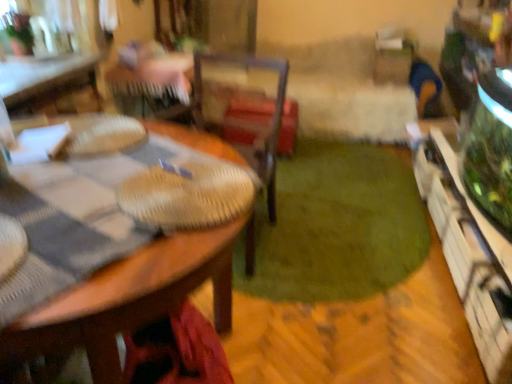
Locate an element on the screen. wooden table at center, which is the 1th table from front to back is located at coordinates (142, 283).

Describe the element at coordinates (337, 226) in the screenshot. I see `green plush carpet at center` at that location.

Where is `wooden table at center, placed as the 2th table when sorted from back to front`? The height and width of the screenshot is (384, 512). wooden table at center, placed as the 2th table when sorted from back to front is located at coordinates (142, 283).

From a real-world perspective, which is physically above, woven wood chair at center or wooden table at upper left, the 2th table when ordered from bottom to top?

wooden table at upper left, the 2th table when ordered from bottom to top, is physically above.

From the image's perspective, who appears lower, woven wood chair at center or wooden table at upper left, placed as the first table when sorted from top to bottom?

Result: woven wood chair at center, from the image's perspective.

Is wooden table at upper left, the 2th table when ordered from bottom to top, inside woven wood chair at center?

No, wooden table at upper left, the 2th table when ordered from bottom to top, is not surrounded by woven wood chair at center.

What's the angular difference between woven wood chair at center and wooden table at upper left, placed as the first table when sorted from top to bottom,'s facing directions?

There is a 97.7-degree angle between the facing directions of woven wood chair at center and wooden table at upper left, placed as the first table when sorted from top to bottom.

Based on the photo, could you measure the distance between wooden table at upper left, the 1th table viewed from the back, and wooden table at center, which is counted as the 2th table, starting from the top?

wooden table at upper left, the 1th table viewed from the back, and wooden table at center, which is counted as the 2th table, starting from the top, are 4.67 feet apart from each other.

In the scene shown: Is wooden table at upper left, which is counted as the 2th table, starting from the front, thinner than wooden table at center, which is the 1th table from front to back?

Yes, wooden table at upper left, which is counted as the 2th table, starting from the front, is thinner than wooden table at center, which is the 1th table from front to back.

Is wooden table at upper left, the 1th table viewed from the back, located outside wooden table at center, the 1th table positioned from the bottom?

wooden table at upper left, the 1th table viewed from the back, is positioned outside wooden table at center, the 1th table positioned from the bottom.

Is wooden table at upper left, the 2th table when ordered from bottom to top, not close to wooden table at center, placed as the 2th table when sorted from back to front?

Yes, wooden table at upper left, the 2th table when ordered from bottom to top, and wooden table at center, placed as the 2th table when sorted from back to front, are located far from each other.

Is wooden table at center, which is the 1th table from front to back, at the back of woven wood chair at center?

woven wood chair at center does not have its back to wooden table at center, which is the 1th table from front to back.

Does point (273, 162) appear closer or farther from the camera than point (79, 299)?

Point (273, 162) is positioned farther from the camera compared to point (79, 299).

From the image's perspective, who appears lower, woven wood chair at center or wooden table at center, the 1th table positioned from the bottom?

wooden table at center, the 1th table positioned from the bottom.

From a real-world perspective, is wooden table at center, placed as the 2th table when sorted from back to front, physically located above or below woven wood chair at center?

From a real-world perspective, wooden table at center, placed as the 2th table when sorted from back to front, is physically below woven wood chair at center.

In the scene shown: Considering the positions of objects wooden table at center, placed as the 2th table when sorted from back to front, and woven wood chair at center in the image provided, who is behind, wooden table at center, placed as the 2th table when sorted from back to front, or woven wood chair at center?

woven wood chair at center is further from the camera.

From the image's perspective, is wooden table at center, the 1th table positioned from the bottom, over woven wood chair at center?

Actually, wooden table at center, the 1th table positioned from the bottom, appears below woven wood chair at center in the image.

Between wooden table at center, which is the 1th table from front to back, and woven wood chair at center, which one appears on the left side from the viewer's perspective?

wooden table at center, which is the 1th table from front to back.

Where is `chair above the green plush carpet at center (from the image's perspective)`? This screenshot has width=512, height=384. chair above the green plush carpet at center (from the image's perspective) is located at coordinates (250, 121).

Based on the photo, which is more to the right, green plush carpet at center or woven wood chair at center?

green plush carpet at center is more to the right.

Does point (424, 220) come closer to viewer compared to point (208, 57)?

That is False.

Considering the points (93, 84) and (374, 187), which point is in front, point (93, 84) or point (374, 187)?

The point (93, 84) is in front.

Is the position of wooden table at upper left, the 1th table viewed from the back, less distant than that of green plush carpet at center?

No, wooden table at upper left, the 1th table viewed from the back, is further to the viewer.

From the image's perspective, is wooden table at upper left, which is counted as the 2th table, starting from the front, positioned above or below green plush carpet at center?

Clearly, from the image's perspective, wooden table at upper left, which is counted as the 2th table, starting from the front, is above green plush carpet at center.

Is wooden table at upper left, the 1th table viewed from the back, spatially inside green plush carpet at center, or outside of it?

wooden table at upper left, the 1th table viewed from the back, is located beyond the bounds of green plush carpet at center.

Is wooden table at center, placed as the 2th table when sorted from back to front, spatially inside green plush carpet at center, or outside of it?

wooden table at center, placed as the 2th table when sorted from back to front, cannot be found inside green plush carpet at center.

Based on the photo, is wooden table at center, the 1th table positioned from the bottom, oriented towards green plush carpet at center?

No, wooden table at center, the 1th table positioned from the bottom, is not turned towards green plush carpet at center.

This screenshot has width=512, height=384. I want to click on chair lying below the wooden table at upper left, the 1th table viewed from the back (from the image's perspective), so click(250, 121).

Where is `table behind the wooden table at center, which is the 1th table from front to back`? The width and height of the screenshot is (512, 384). table behind the wooden table at center, which is the 1th table from front to back is located at coordinates (44, 79).

From the image, which object appears to be nearer to woven wood chair at center, wooden table at center, the 1th table positioned from the bottom, or green plush carpet at center?

Among the two, green plush carpet at center is located nearer to woven wood chair at center.

Based on their spatial positions, is wooden table at center, placed as the 2th table when sorted from back to front, or wooden table at upper left, the 1th table viewed from the back, further from green plush carpet at center?

wooden table at upper left, the 1th table viewed from the back, is positioned further to the anchor green plush carpet at center.

Considering their positions, is green plush carpet at center positioned closer to woven wood chair at center than wooden table at center, which is the 1th table from front to back?

green plush carpet at center lies closer to woven wood chair at center than the other object.

Considering their positions, is wooden table at center, which is counted as the 2th table, starting from the top, positioned closer to wooden table at upper left, the 1th table viewed from the back, than green plush carpet at center?

wooden table at center, which is counted as the 2th table, starting from the top, lies closer to wooden table at upper left, the 1th table viewed from the back, than the other object.

From the picture: Considering their positions, is woven wood chair at center positioned closer to wooden table at center, which is counted as the 2th table, starting from the top, than wooden table at upper left, the 2th table when ordered from bottom to top?

woven wood chair at center is closer to wooden table at center, which is counted as the 2th table, starting from the top.

Which object lies nearer to the anchor point wooden table at center, placed as the 2th table when sorted from back to front, green plush carpet at center or woven wood chair at center?

Among the two, woven wood chair at center is located nearer to wooden table at center, placed as the 2th table when sorted from back to front.

Looking at the image, which one is located further to wooden table at upper left, the 2th table when ordered from bottom to top, green plush carpet at center or wooden table at center, which is counted as the 2th table, starting from the top?

The object further to wooden table at upper left, the 2th table when ordered from bottom to top, is green plush carpet at center.

From the image, which object appears to be nearer to wooden table at center, the 1th table positioned from the bottom, wooden table at upper left, which is counted as the 2th table, starting from the front, or green plush carpet at center?

wooden table at upper left, which is counted as the 2th table, starting from the front, lies closer to wooden table at center, the 1th table positioned from the bottom, than the other object.

At what (x,y) coordinates should I click in order to perform the action: click on chair between wooden table at center, which is counted as the 2th table, starting from the top, and green plush carpet at center from front to back. Please return your answer as a coordinate pair (x, y). This screenshot has width=512, height=384. Looking at the image, I should click on (250, 121).

Identify the location of chair between wooden table at center, which is counted as the 2th table, starting from the top, and wooden table at upper left, placed as the first table when sorted from top to bottom, along the z-axis. The image size is (512, 384). (250, 121).

Find the location of a particular element. This screenshot has height=384, width=512. chair located between wooden table at upper left, the 2th table when ordered from bottom to top, and green plush carpet at center in the left-right direction is located at coordinates (250, 121).

You are a GUI agent. You are given a task and a screenshot of the screen. Output one action in this format:
    pyautogui.click(x=<x>, y=<y>)
    Task: Click on the table between wooden table at upper left, which is counted as the 2th table, starting from the front, and green plush carpet at center from left to right
    
    Given the screenshot: What is the action you would take?
    pyautogui.click(x=142, y=283)